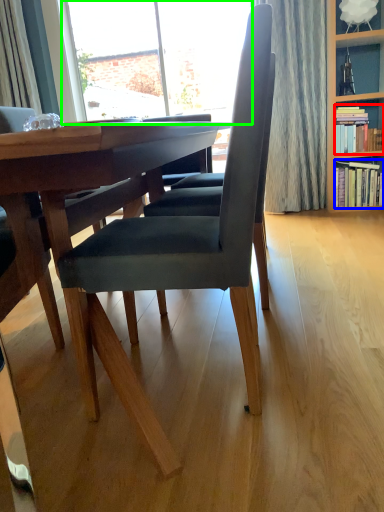
Question: Which is farther away from book (highlighted by a red box)? book (highlighted by a blue box) or window (highlighted by a green box)?

Choices:
 (A) book
 (B) window

Answer: (B)